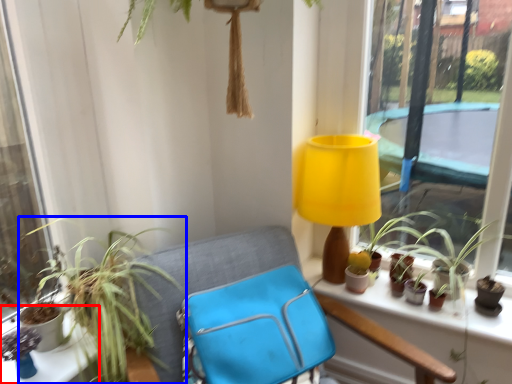
Question: Among these objects, which one is farthest to the camera, table (highlighted by a red box) or houseplant (highlighted by a blue box)?

Choices:
 (A) table
 (B) houseplant

Answer: (A)